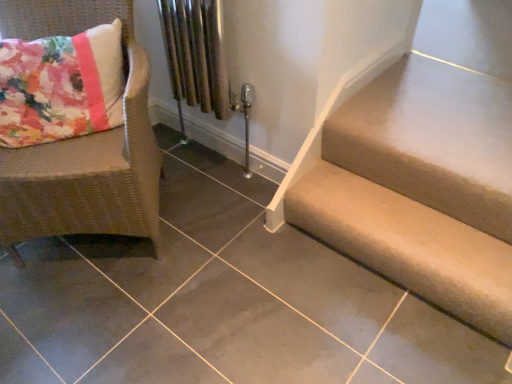
Question: Considering the relative positions of beige fabric stairs at lower right and woven rattan chair at left in the image provided, is beige fabric stairs at lower right to the left of woven rattan chair at left from the viewer's perspective?

Choices:
 (A) no
 (B) yes

Answer: (A)

Question: Is beige fabric stairs at lower right oriented towards woven rattan chair at left?

Choices:
 (A) no
 (B) yes

Answer: (A)

Question: Can you confirm if beige fabric stairs at lower right is taller than woven rattan chair at left?

Choices:
 (A) no
 (B) yes

Answer: (A)

Question: Is beige fabric stairs at lower right directly adjacent to woven rattan chair at left?

Choices:
 (A) no
 (B) yes

Answer: (A)

Question: Can you confirm if beige fabric stairs at lower right is wider than woven rattan chair at left?

Choices:
 (A) yes
 (B) no

Answer: (B)

Question: Considering the relative sizes of beige fabric stairs at lower right and woven rattan chair at left in the image provided, is beige fabric stairs at lower right bigger than woven rattan chair at left?

Choices:
 (A) yes
 (B) no

Answer: (B)

Question: Can we say woven rattan chair at left lies outside beige fabric stairs at lower right?

Choices:
 (A) yes
 (B) no

Answer: (A)

Question: Does woven rattan chair at left come in front of beige fabric stairs at lower right?

Choices:
 (A) no
 (B) yes

Answer: (B)

Question: Considering the relative positions of woven rattan chair at left and beige fabric stairs at lower right in the image provided, is woven rattan chair at left to the left of beige fabric stairs at lower right from the viewer's perspective?

Choices:
 (A) yes
 (B) no

Answer: (A)

Question: Is beige fabric stairs at lower right at the back of woven rattan chair at left?

Choices:
 (A) no
 (B) yes

Answer: (A)

Question: From a real-world perspective, is woven rattan chair at left below beige fabric stairs at lower right?

Choices:
 (A) yes
 (B) no

Answer: (B)

Question: Considering the relative sizes of woven rattan chair at left and beige fabric stairs at lower right in the image provided, is woven rattan chair at left shorter than beige fabric stairs at lower right?

Choices:
 (A) yes
 (B) no

Answer: (B)

Question: Choose the correct answer: Is woven rattan chair at left inside beige fabric stairs at lower right or outside it?

Choices:
 (A) outside
 (B) inside

Answer: (A)